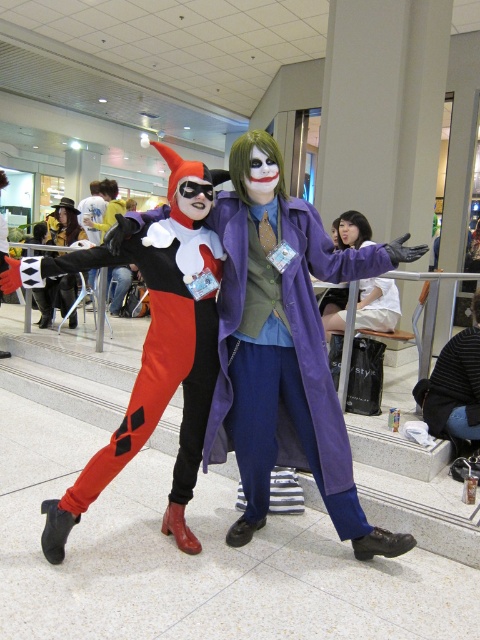
Question: Which of these objects is positioned closest to the matte black and white costume at center?

Choices:
 (A) matte black and red spandex pants at center
 (B) denim jacket at lower right
 (C) purple fabric coat at center

Answer: (C)

Question: Which point is closer to the camera taking this photo?

Choices:
 (A) (239, 220)
 (B) (68, 268)

Answer: (B)

Question: Does matte black and red spandex pants at center appear under denim jacket at lower right?

Choices:
 (A) no
 (B) yes

Answer: (A)

Question: Estimate the real-world distances between objects in this image. Which object is closer to the denim jacket at lower right?

Choices:
 (A) purple fabric coat at center
 (B) matte black and white costume at center
 (C) matte black and red spandex pants at center

Answer: (A)

Question: Is matte black and white costume at center positioned at the back of matte black and red spandex pants at center?

Choices:
 (A) yes
 (B) no

Answer: (B)

Question: Is the position of matte black and white costume at center less distant than that of denim jacket at lower right?

Choices:
 (A) no
 (B) yes

Answer: (B)